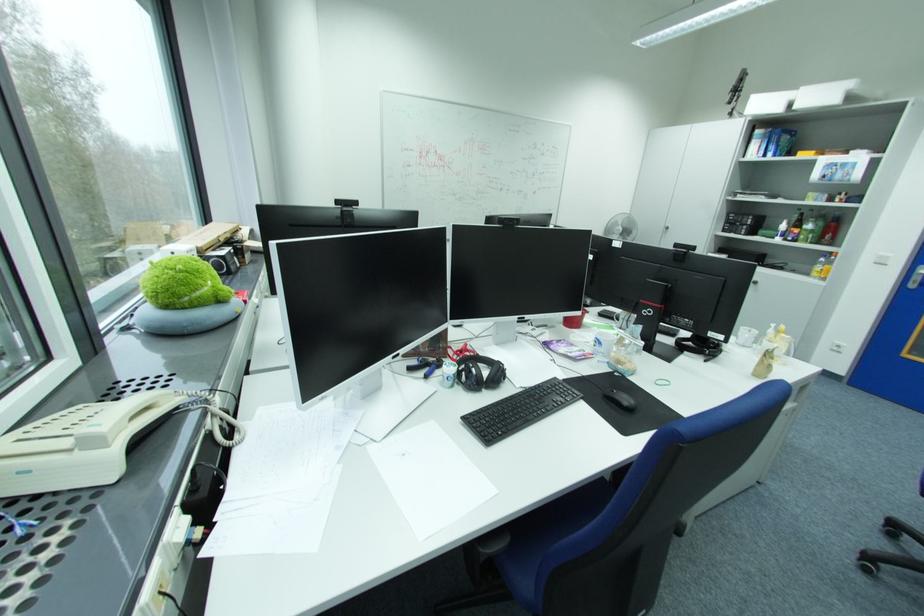
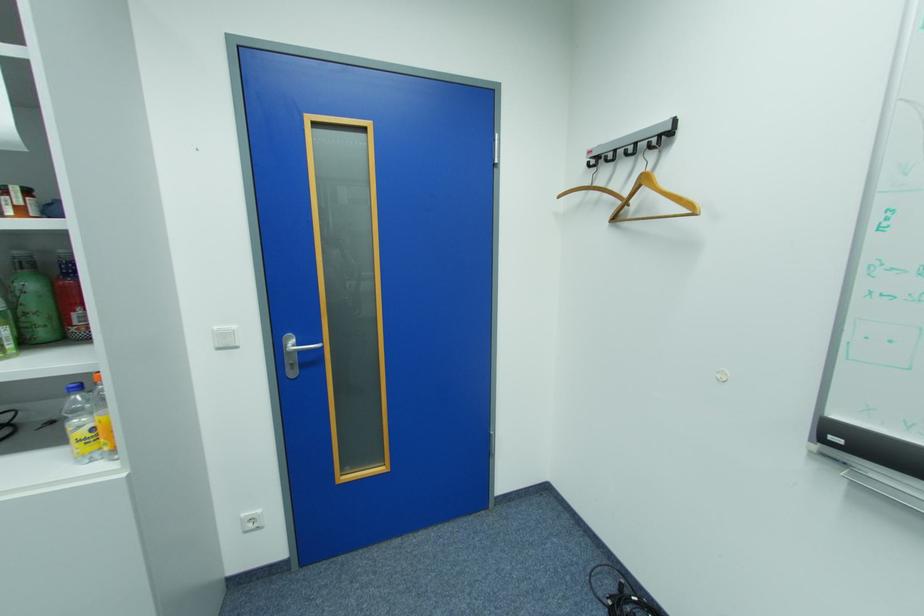
In the second image, find the point that corresponds to point 845,342 in the first image.

(252, 516)